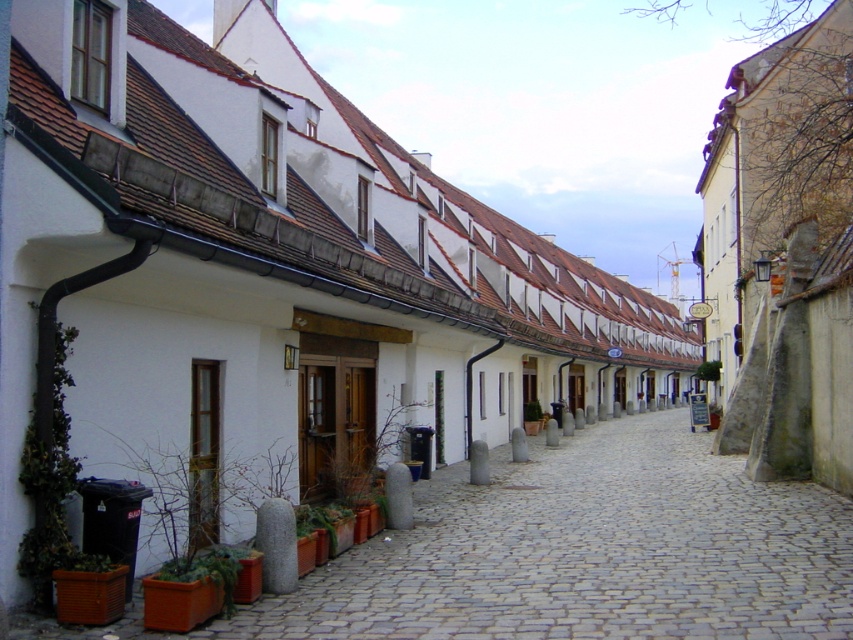
Question: Which object is the farthest from the green leafy plant at center?

Choices:
 (A) green matte plant at center
 (B) smooth stone path at center

Answer: (A)

Question: Estimate the real-world distances between objects in this image. Which object is closer to the smooth stone path at center?

Choices:
 (A) green leafy plant at center
 (B) green matte plant at center

Answer: (B)

Question: Estimate the real-world distances between objects in this image. Which object is farther from the smooth stone path at center?

Choices:
 (A) green matte plant at center
 (B) green leafy plant at center

Answer: (B)

Question: Is smooth stone path at center above green leafy plant at center?

Choices:
 (A) no
 (B) yes

Answer: (A)

Question: Does smooth stone path at center have a lesser width compared to green leafy plant at center?

Choices:
 (A) yes
 (B) no

Answer: (B)

Question: Does green matte plant at center have a smaller size compared to green leafy plant at center?

Choices:
 (A) yes
 (B) no

Answer: (A)